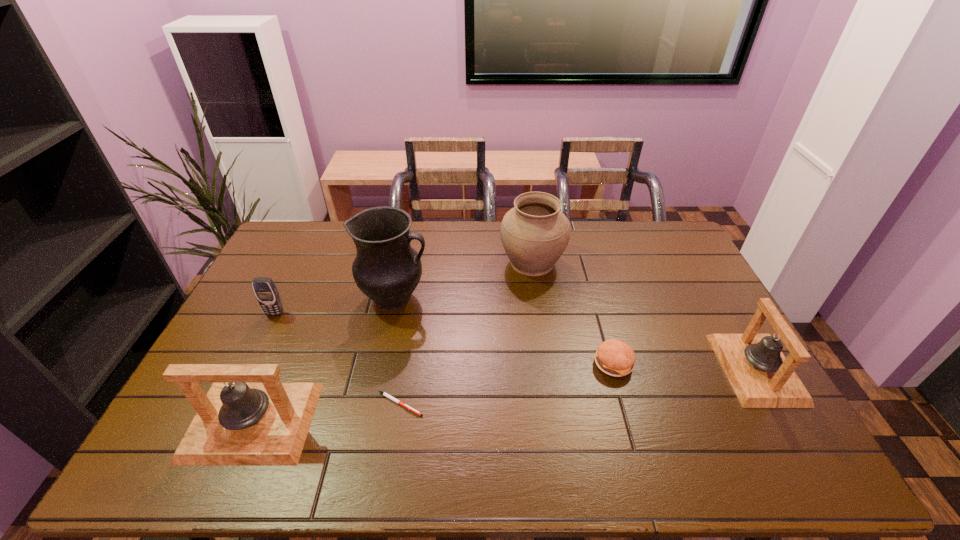
Identify the location of vacant space that is in between the third shortest object and the hamburger. (444, 339).

Find the location of a particular element. vacant space in between the fifth object from left to right and the pitcher is located at coordinates (464, 280).

You are a GUI agent. You are given a task and a screenshot of the screen. Output one action in this format:
    pyautogui.click(x=<x>, y=<y>)
    Task: Click on the vacant space that is in between the tallest object and the shortest object
    This screenshot has width=960, height=540.
    Given the screenshot: What is the action you would take?
    pyautogui.click(x=397, y=351)

Find the location of `vacant area between the third object from right to left and the pen`. vacant area between the third object from right to left and the pen is located at coordinates (466, 333).

The image size is (960, 540). What are the coordinates of `free space between the left bell and the right bell` in the screenshot? It's located at (504, 395).

Locate an element on the screen. The image size is (960, 540). free space that is in between the pen and the taller bell is located at coordinates (325, 413).

Where is `free space between the shortest object and the pitcher`? Image resolution: width=960 pixels, height=540 pixels. free space between the shortest object and the pitcher is located at coordinates (397, 351).

This screenshot has height=540, width=960. Find the location of `vacant area between the right bell and the second object from right to left`. vacant area between the right bell and the second object from right to left is located at coordinates (684, 366).

The width and height of the screenshot is (960, 540). In order to click on vacant space that's between the urn and the hamburger in this screenshot , I will do `click(573, 313)`.

Find the location of a particular element. This screenshot has height=540, width=960. blank region between the urn and the pen is located at coordinates pos(466,333).